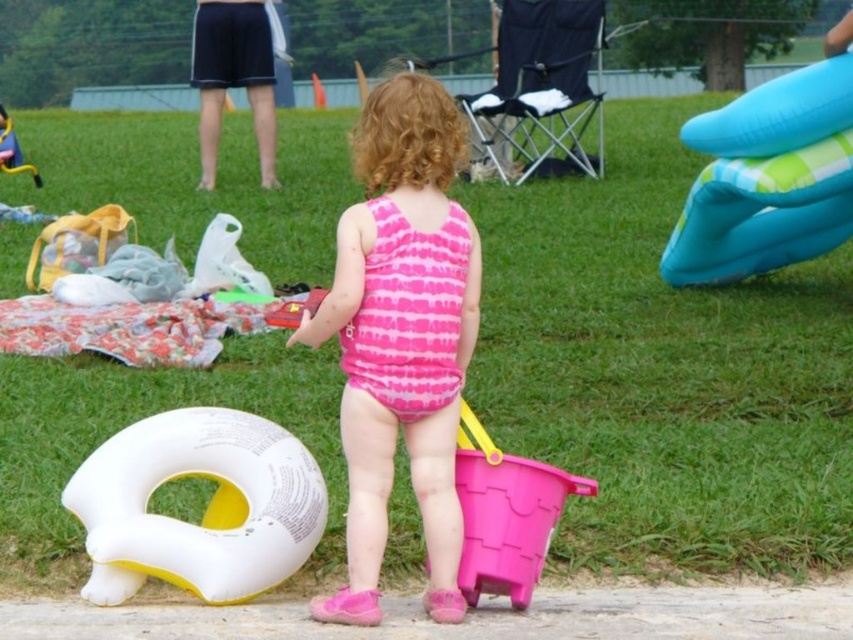
Question: Can you confirm if white rubber ring at lower left is bigger than pink plastic bucket at lower center?

Choices:
 (A) yes
 (B) no

Answer: (A)

Question: Which point is farther to the camera?

Choices:
 (A) (207, 460)
 (B) (492, 541)
 (C) (755, 224)

Answer: (C)

Question: In this image, where is pink tie-dye swimsuit at center located relative to white rubber ring at lower left?

Choices:
 (A) right
 (B) left

Answer: (A)

Question: Does pink tie-dye swimsuit at center have a larger size compared to pink plastic bucket at lower center?

Choices:
 (A) yes
 (B) no

Answer: (A)

Question: Which point is closer to the camera?

Choices:
 (A) (509, 461)
 (B) (358, 544)
 (C) (239, 428)
 (D) (730, 129)

Answer: (B)

Question: Which of the following is the closest to the observer?

Choices:
 (A) (518, 538)
 (B) (743, 113)

Answer: (A)